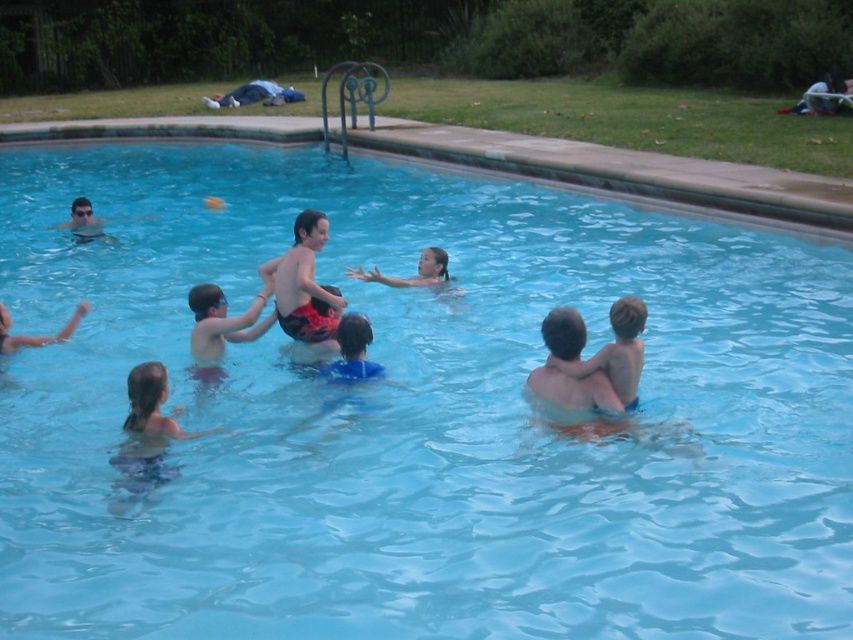
Question: Does smooth skin child at center lie behind smooth skin girl at center?

Choices:
 (A) yes
 (B) no

Answer: (B)

Question: Which point is farther to the camera?

Choices:
 (A) smooth skin girl at center
 (B) reddish-orange swim trunks at center

Answer: (A)

Question: Which point is closer to the camera?

Choices:
 (A) reddish-orange swim trunks at center
 (B) smooth skin girl at center
 (C) smooth skin child at center

Answer: (C)

Question: Is reddish-orange swim trunks at center above blue fabric shirt at center?

Choices:
 (A) no
 (B) yes

Answer: (B)

Question: Which of the following is the closest to the observer?

Choices:
 (A) (86, 220)
 (B) (438, 257)
 (C) (335, 369)

Answer: (C)

Question: Is reddish-orange swim trunks at center positioned in front of matte gray swimmer at upper left?

Choices:
 (A) yes
 (B) no

Answer: (A)